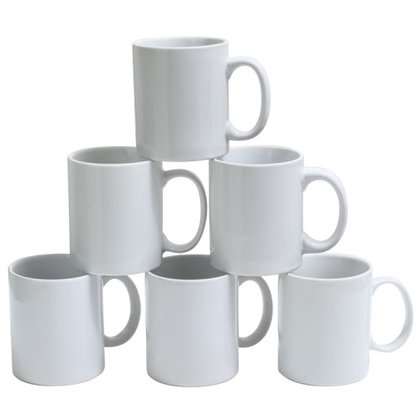
Where is `handles`? handles is located at coordinates (134, 299), (262, 302), (404, 313), (343, 217), (197, 208), (264, 105).